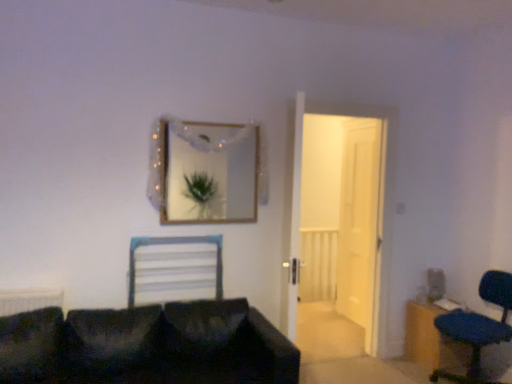
Question: From the image's perspective, is white wooden door at center, the 1th door from the back, above or below wooden dresser at lower right?

Choices:
 (A) below
 (B) above

Answer: (B)

Question: Do you think white wooden door at center, the 2th door from the front, is within wooden dresser at lower right, or outside of it?

Choices:
 (A) outside
 (B) inside

Answer: (A)

Question: Which is nearer to the black fabric couch at lower left?

Choices:
 (A) white wooden door at center, the 1th door from the back
 (B) translucent plastic curtain at upper center
 (C) gold-framed mirror at upper center
 (D) white glossy door at center, which is the 1th door in front-to-back order
 (E) blue fabric chair at lower right

Answer: (B)

Question: Which object is positioned farthest from the black fabric couch at lower left?

Choices:
 (A) white glossy door at center, which is the 1th door in front-to-back order
 (B) blue fabric chair at lower right
 (C) white plastic chair at center
 (D) translucent plastic curtain at upper center
 (E) white wooden door at center, the 1th door from the back

Answer: (A)